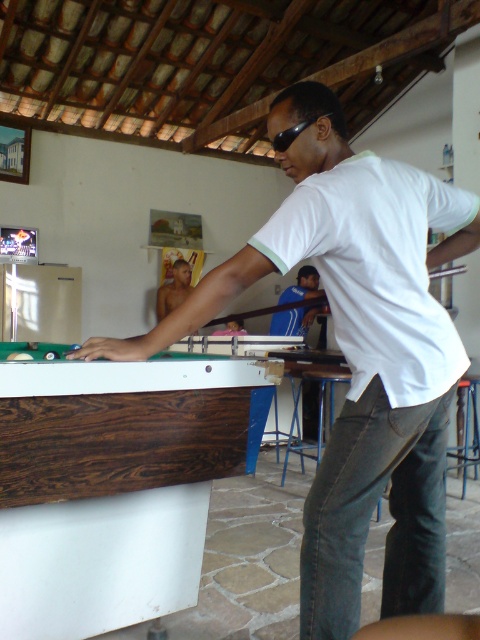
You are standing in the recreational room and want to place a small decorative item on the dark wood billiard table at left. Given that the table occupies the coordinate point at (121, 422), can you confirm if this point is on the table?

Yes, the point at (121, 422) is on the dark wood billiard table at left as specified in the description.

You are standing in the recreational room and want to move from the blue fabric shirt at center to the dark wood billiard table at left. Which direction should you move to reach the table?

To move from the blue fabric shirt at center to the dark wood billiard table at left, you should move to the left since the dark wood billiard table at left is located to the left of the blue fabric shirt at center.

In the scene shown: You are a pool cue that is 1.4 meters long. You are lying on the dark wood billiard table at left. You want to reach the shiny skin torso at center. Can you extend your full length to reach it?

The distance between dark wood billiard table at left and shiny skin torso at center is 3.86 meters. Since the pool cue is only 1.4 meters long, it cannot reach the shiny skin torso at center by extending its full length.